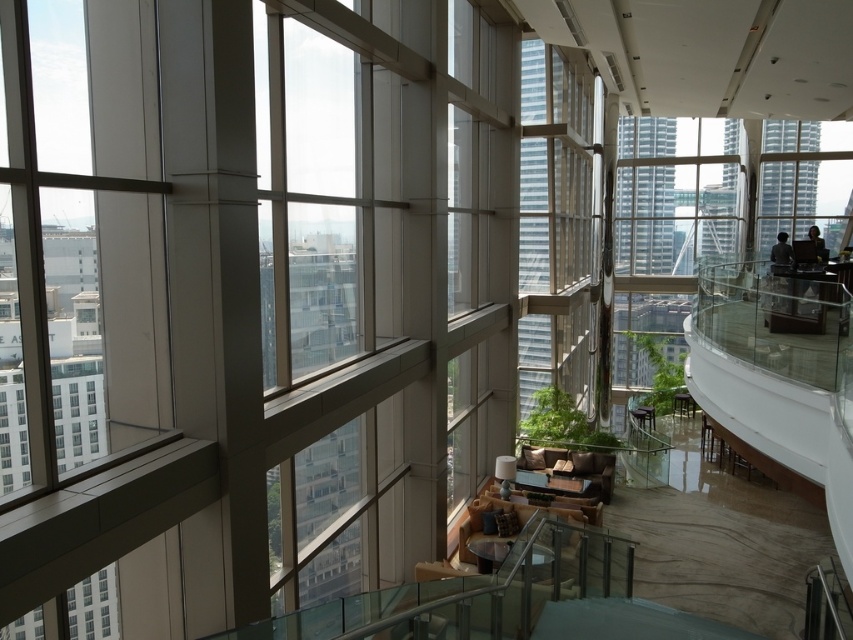
Question: In this image, where is transparent glass window at lower left located relative to dark brown leather jacket at upper right?

Choices:
 (A) left
 (B) right

Answer: (A)

Question: Which point is farther from the camera taking this photo?

Choices:
 (A) (820, 257)
 (B) (93, 634)
 (C) (779, 243)

Answer: (A)

Question: Is transparent glass window at lower left positioned in front of dark brown leather jacket at upper right?

Choices:
 (A) no
 (B) yes

Answer: (B)

Question: Based on their relative distances, which object is nearer to the transparent glass window at lower left?

Choices:
 (A) dark brown leather jacket at upper right
 (B) dark hair at upper right

Answer: (B)

Question: From the image, what is the correct spatial relationship of transparent glass window at lower left in relation to dark hair at upper right?

Choices:
 (A) below
 (B) above

Answer: (A)

Question: Which of these objects is positioned closest to the dark hair at upper right?

Choices:
 (A) dark brown leather jacket at upper right
 (B) transparent glass window at lower left

Answer: (A)